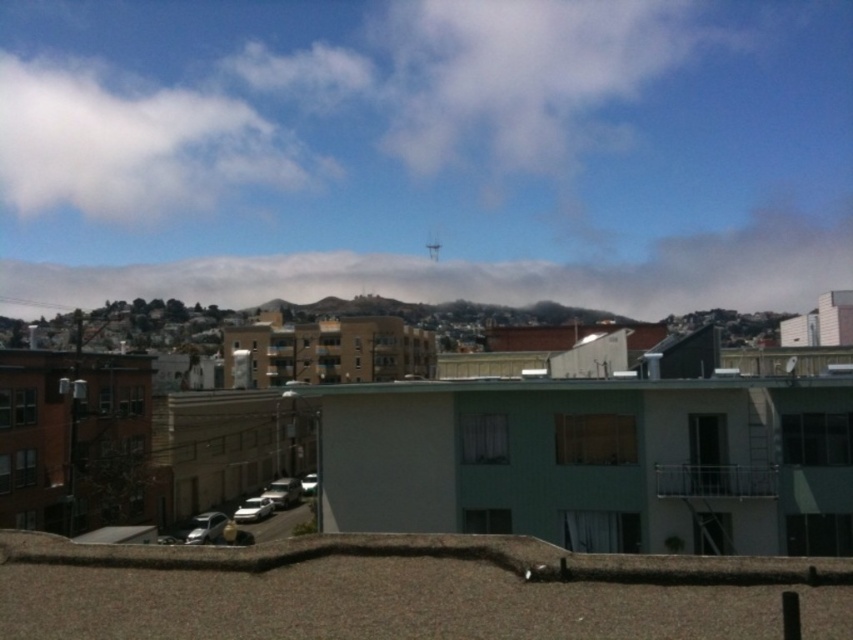
Question: Is white fluffy cloud at upper center positioned before white fluffy cloud at upper left?

Choices:
 (A) no
 (B) yes

Answer: (B)

Question: Does white fluffy cloud at upper center appear on the left side of white fluffy cloud at upper left?

Choices:
 (A) no
 (B) yes

Answer: (A)

Question: Which point is closer to the camera?

Choices:
 (A) white fluffy cloud at upper left
 (B) white fluffy cloud at upper center

Answer: (B)

Question: Is white fluffy cloud at upper center positioned behind white fluffy cloud at upper left?

Choices:
 (A) yes
 (B) no

Answer: (B)

Question: Which of the following is the closest to the observer?

Choices:
 (A) (473, 285)
 (B) (115, 189)

Answer: (A)